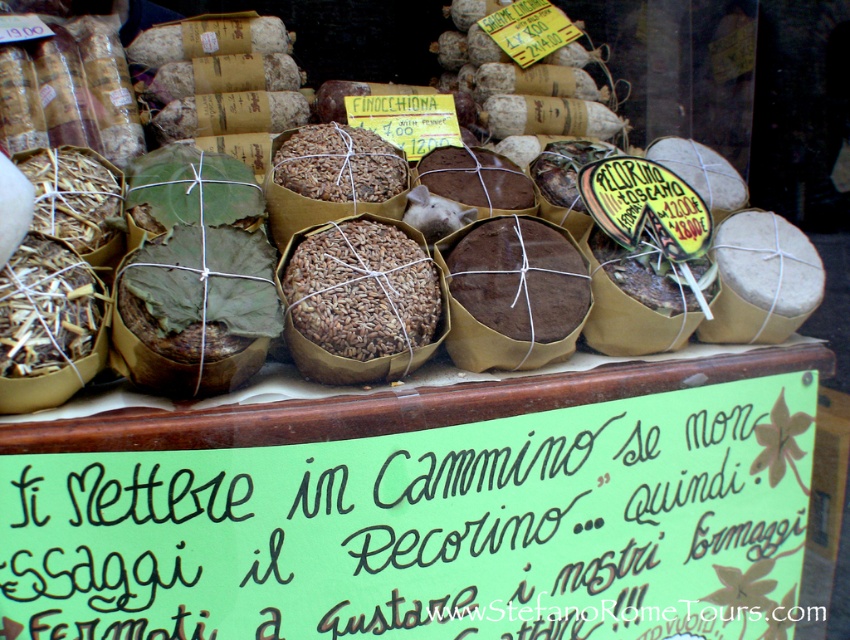
You are a customer looking at the shop window. You want to pick up the brown textured grain at center but it is blocked by the brown paper wrapped cheese at center. Can you move the cheese to access it?

The brown textured grain at center is behind the brown paper wrapped cheese at center, so you can move the cheese to access it.

You are a customer in the shop and want to place an order for both the brown textured bread at center and the brown textured grain at center. The cashier asks you to confirm the items based on their positions. Which item is closer to the left edge of the shelf?

The brown textured bread at center is closer to the left edge of the shelf than the brown textured grain at center.

Based on the photo, you are a customer looking at the display in the shop window. You see the brown textured bread at center and the brown textured grain at center. Which one is positioned to the right of the other?

The brown textured bread at center is to the right of the brown textured grain at center.